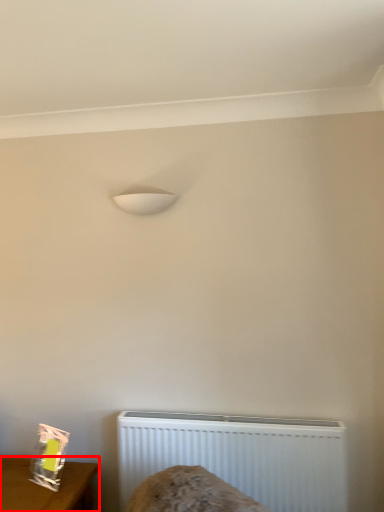
Question: Observing the image, what is the correct spatial positioning of furniture (annotated by the red box) in reference to radiator?

Choices:
 (A) right
 (B) left

Answer: (B)